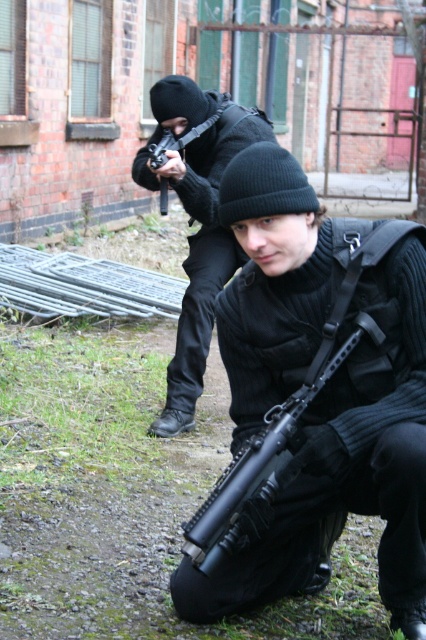
You are a military analyst assessing the scene. You notice two rifles labeled as matte black rifle at center and black matte rifle at center in the image. Which one is taller?

The matte black rifle at center is taller than the black matte rifle at center.

You are a member of the team observing the situation. There are two rifles present in the scene, a matte black rifle at center and a black matte rifle at center. Which rifle is positioned behind the other?

The black matte rifle at center is behind the matte black rifle at center according to the description.